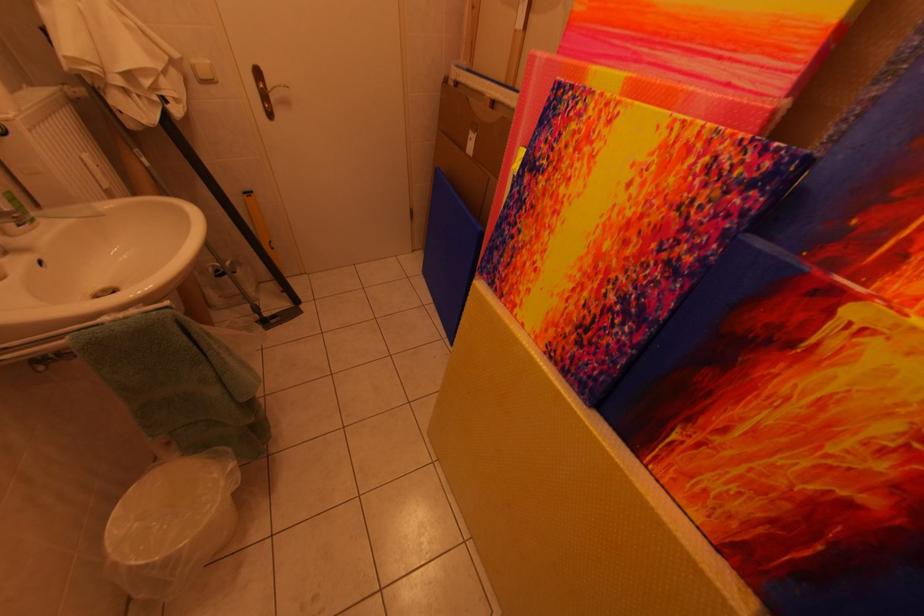
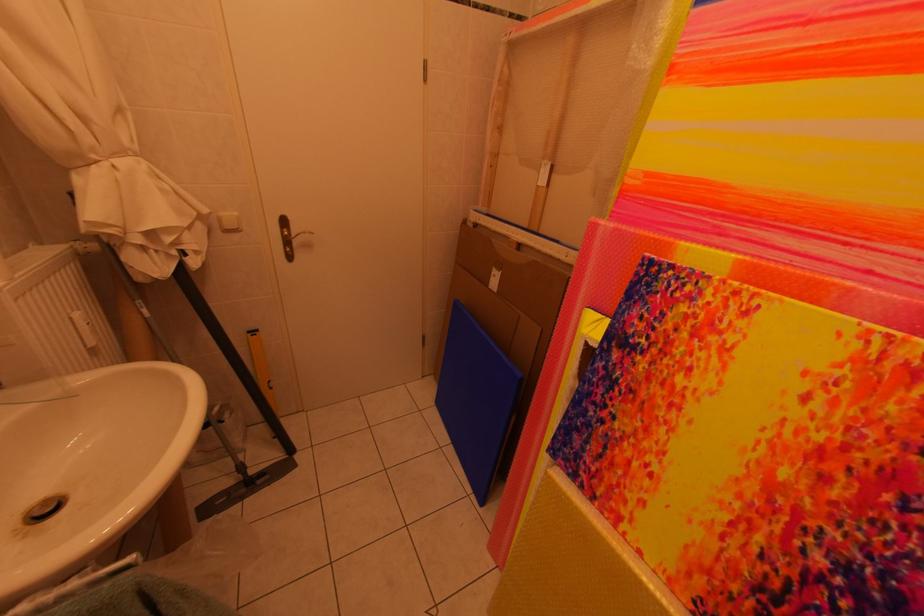
Question: The first image is from the beginning of the video and the second image is from the end. How did the camera likely rotate when shooting the video?

Choices:
 (A) Left
 (B) Right
 (C) Up
 (D) Down

Answer: (C)